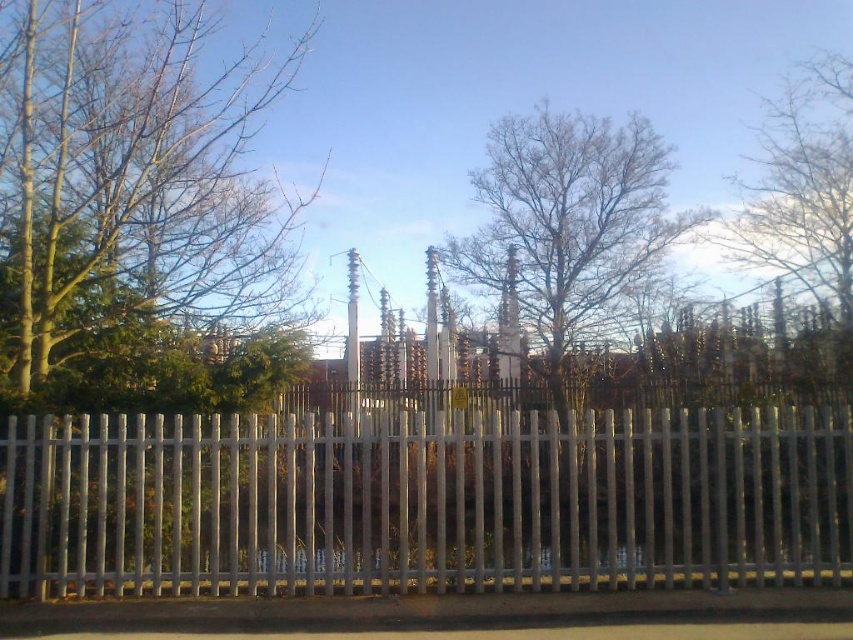
Question: Which of these objects is positioned farthest from the bare branches at upper right?

Choices:
 (A) white metal fence at center
 (B) green leafy tree at left

Answer: (A)

Question: Can you confirm if green leafy tree at left is positioned below bare branches at upper right?

Choices:
 (A) no
 (B) yes

Answer: (B)

Question: Is white metal fence at center to the left of bare branches at upper right from the viewer's perspective?

Choices:
 (A) no
 (B) yes

Answer: (B)

Question: Which point appears closest to the camera in this image?

Choices:
 (A) (286, 212)
 (B) (793, 420)
 (C) (796, 276)

Answer: (B)

Question: Among these points, which one is farthest from the camera?

Choices:
 (A) (711, 582)
 (B) (834, 100)
 (C) (91, 346)

Answer: (B)

Question: Can you confirm if green leafy tree at left is positioned to the right of bare branches at upper right?

Choices:
 (A) yes
 (B) no

Answer: (B)